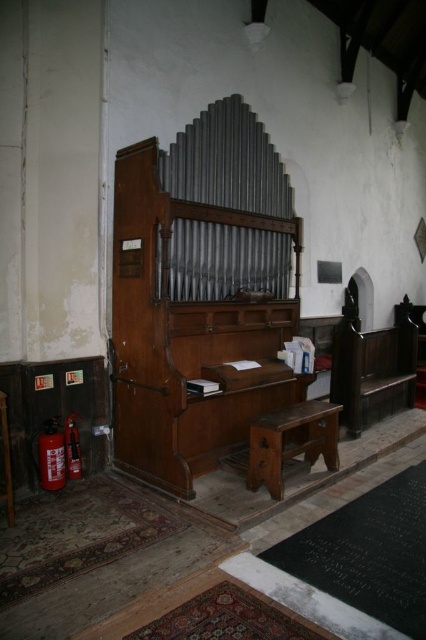
Question: Which of the following is the closest to the observer?

Choices:
 (A) red matte fire extinguisher at lower left
 (B) brown wooden bench at center

Answer: (B)

Question: Is brown wooden bench at center bigger than red matte fire extinguisher at lower left?

Choices:
 (A) no
 (B) yes

Answer: (B)

Question: Which object appears closest to the camera in this image?

Choices:
 (A) red matte fire extinguisher at lower left
 (B) brown wooden bench at center
 (C) red matte extinguisher at lower left

Answer: (B)

Question: Does brown wooden bench at center appear on the left side of red matte fire extinguisher at lower left?

Choices:
 (A) yes
 (B) no

Answer: (B)

Question: Which object is the farthest from the red matte extinguisher at lower left?

Choices:
 (A) red matte fire extinguisher at lower left
 (B) brown wooden bench at center

Answer: (B)

Question: Where is brown wooden bench at center located in relation to red matte extinguisher at lower left in the image?

Choices:
 (A) above
 (B) below

Answer: (B)